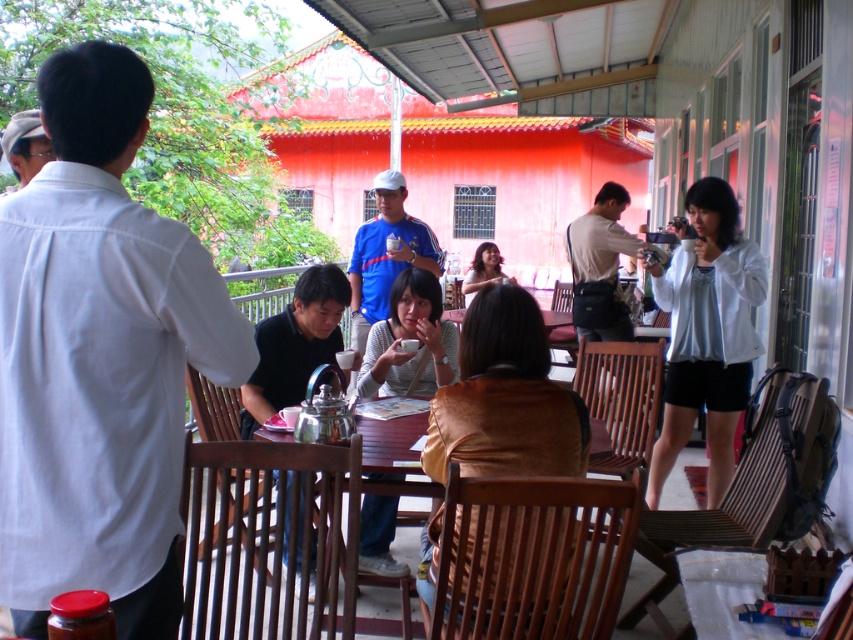
Question: Which object is the farthest from the white cotton shirt at left?

Choices:
 (A) black matte shirt at center
 (B) white matte jacket at right
 (C) smooth brown hair at center

Answer: (C)

Question: In this image, where is white cotton shirt at left located relative to smooth brown hair at center?

Choices:
 (A) left
 (B) right

Answer: (A)

Question: Which of the following is the farthest from the observer?

Choices:
 (A) white matte jacket at right
 (B) matte brown sweater at center
 (C) white cotton shirt at left
 (D) smooth brown hair at center

Answer: (D)

Question: Does white matte jacket at right have a larger size compared to black matte shirt at center?

Choices:
 (A) yes
 (B) no

Answer: (A)

Question: Observing the image, what is the correct spatial positioning of white cotton shirt at left in reference to black matte shirt at center?

Choices:
 (A) left
 (B) right

Answer: (A)

Question: Which of the following is the closest to the observer?

Choices:
 (A) (334, 282)
 (B) (468, 300)
 (C) (10, 552)

Answer: (C)